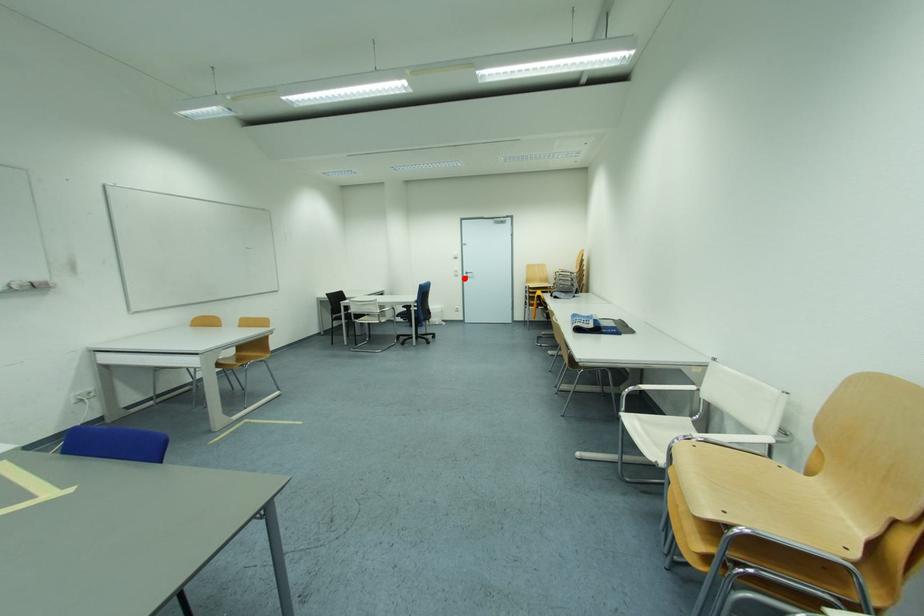
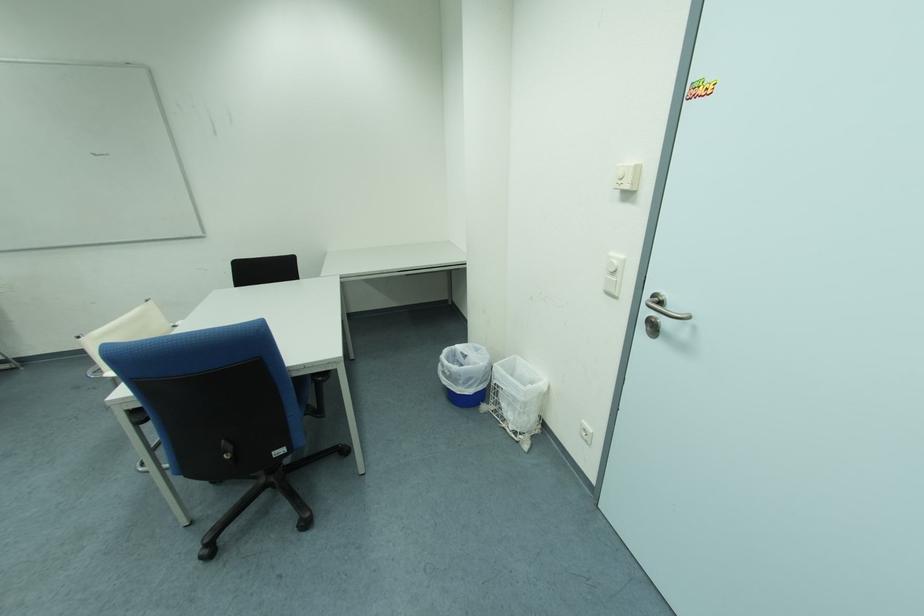
The point at the highlighted location is marked in the first image. Where is the corresponding point in the second image?

(616, 296)